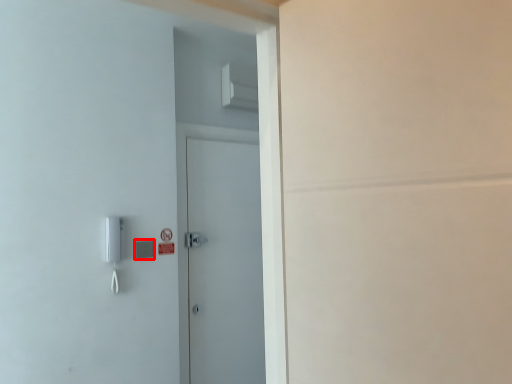
Question: From the image's perspective, where is light switch (annotated by the red box) located relative to door?

Choices:
 (A) below
 (B) above

Answer: (B)